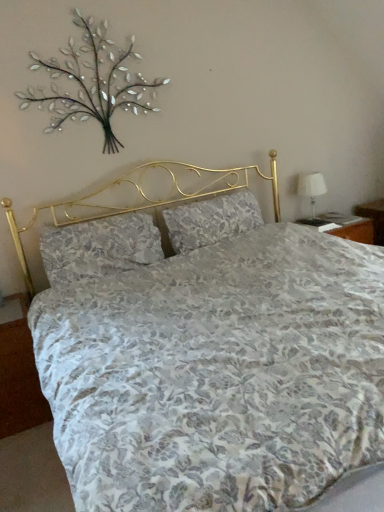
From a real-world perspective, locate several points in the blank space situated above metallic silver branches at upper left. Your answer should be formatted as a list of tuples, i.e. [(x1, y1)], where each tuple contains the x and y coordinates of a point satisfying the conditions above.

[(0.124, -0.000)]